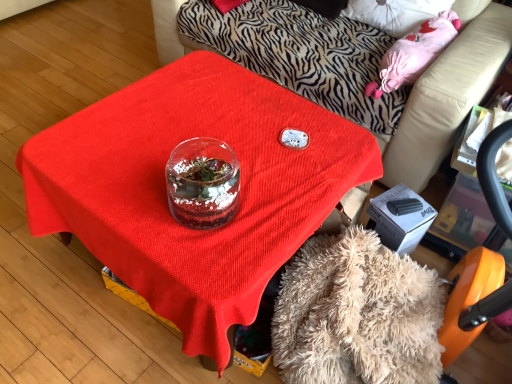
Question: Is transparent glass jar at center positioned in front of transparent glass terrarium at center?

Choices:
 (A) yes
 (B) no

Answer: (B)

Question: Can you confirm if transparent glass jar at center is positioned to the left of transparent glass terrarium at center?

Choices:
 (A) no
 (B) yes

Answer: (A)

Question: From the image's perspective, is transparent glass jar at center located beneath transparent glass terrarium at center?

Choices:
 (A) yes
 (B) no

Answer: (B)

Question: Is transparent glass jar at center not inside transparent glass terrarium at center?

Choices:
 (A) yes
 (B) no

Answer: (A)

Question: From a real-world perspective, does transparent glass jar at center stand above transparent glass terrarium at center?

Choices:
 (A) no
 (B) yes

Answer: (B)

Question: Is transparent glass jar at center looking in the opposite direction of transparent glass terrarium at center?

Choices:
 (A) no
 (B) yes

Answer: (A)

Question: Is the surface of fuzzy beige blanket at lower center in direct contact with transparent glass terrarium at center?

Choices:
 (A) no
 (B) yes

Answer: (A)

Question: Is fuzzy beige blanket at lower center shorter than transparent glass terrarium at center?

Choices:
 (A) no
 (B) yes

Answer: (B)

Question: Can you confirm if fuzzy beige blanket at lower center is smaller than transparent glass terrarium at center?

Choices:
 (A) no
 (B) yes

Answer: (B)

Question: Is transparent glass terrarium at center located within fuzzy beige blanket at lower center?

Choices:
 (A) no
 (B) yes

Answer: (A)

Question: Is the depth of fuzzy beige blanket at lower center greater than that of transparent glass terrarium at center?

Choices:
 (A) yes
 (B) no

Answer: (B)

Question: From a real-world perspective, does fuzzy beige blanket at lower center stand above transparent glass terrarium at center?

Choices:
 (A) yes
 (B) no

Answer: (B)

Question: From the image's perspective, would you say fuzzy beige blanket at lower center is positioned over transparent glass jar at center?

Choices:
 (A) yes
 (B) no

Answer: (B)